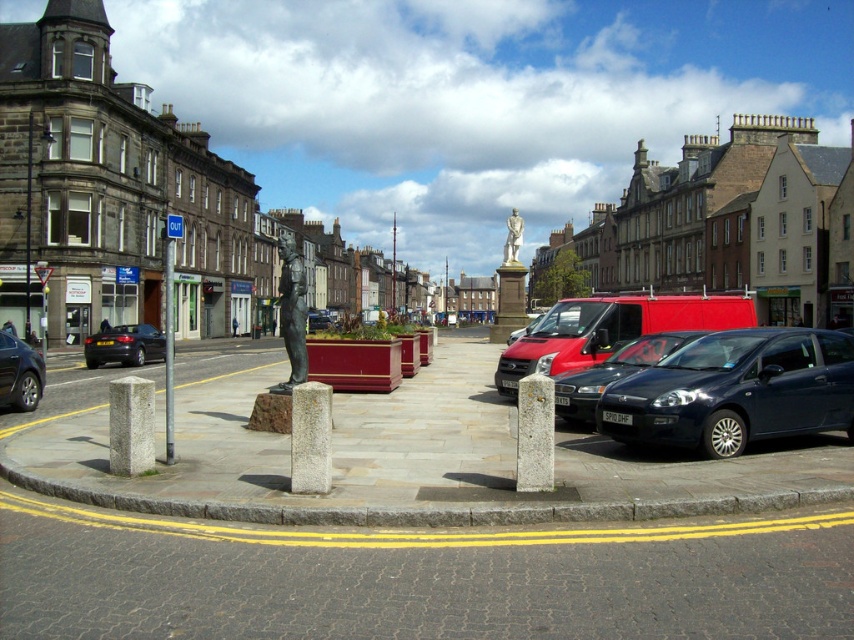
You are a delivery driver who needs to park your van, which is 6 meters long, between the shiny black sedan at lower left and the brushed metal pole at left. Is there enough space for your van?

The distance between the shiny black sedan at lower left and the brushed metal pole at left is 6.44 meters. Since the van is 6 meters long, there is enough space to park it between them.

You are standing at the statue in the urban square and want to walk towards the point labeled point (27, 397). Which direction should you go relative to the point labeled point (168, 296)?

You should walk towards the point labeled point (27, 397), which is in front of the point labeled point (168, 296).